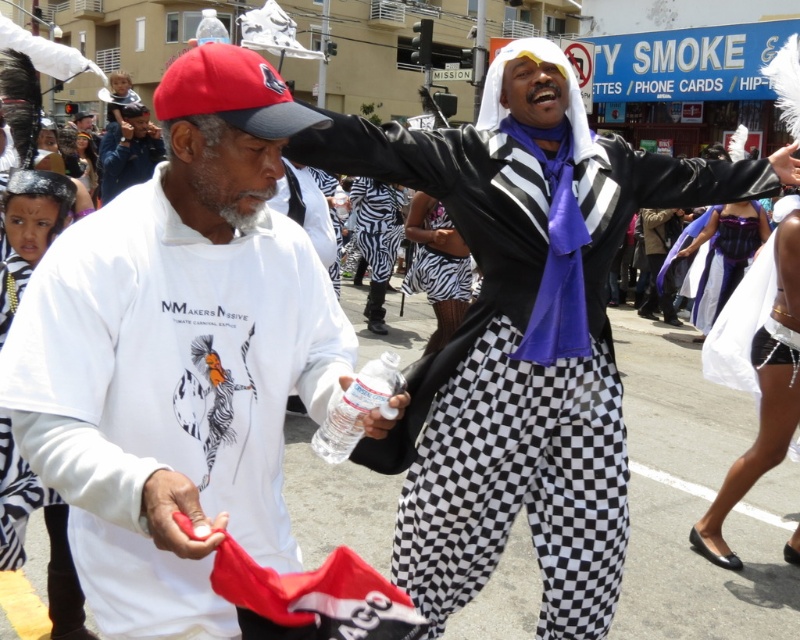
You are a photographer at the parade trying to capture both the matte black jacket at center and the zebra print pants at center in a single frame. Your camera has a maximum focus range of 10 feet. Can you fit both subjects within the camera focus range?

The matte black jacket at center is 12.59 feet from the zebra print pants at center, which exceeds the camera focus range of 10 feet. Therefore, both subjects cannot be captured in focus simultaneously.